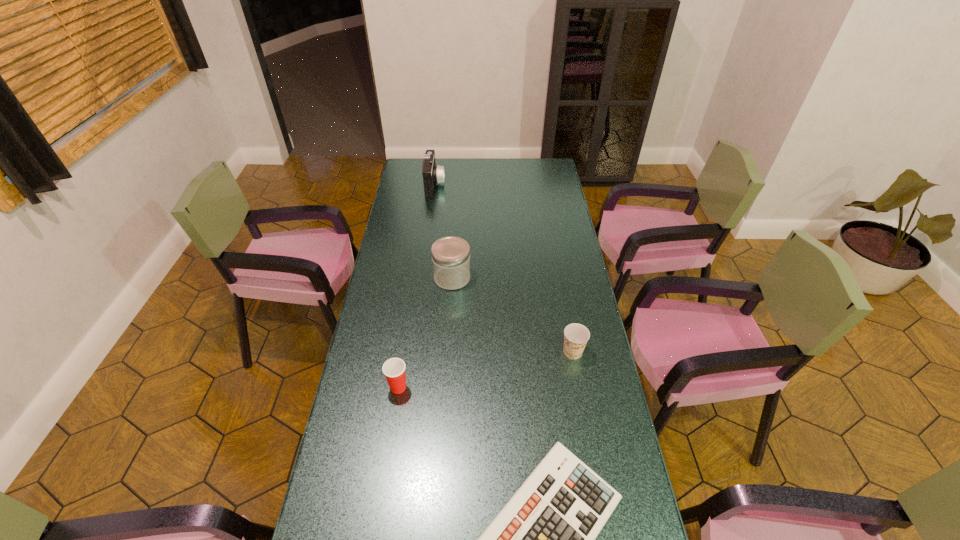
The image size is (960, 540). Identify the location of free space between the farthest object and the jar. (444, 231).

The image size is (960, 540). In order to click on empty space between the second nearest object and the camcorder in this screenshot , I will do [417, 286].

At what (x,y) coordinates should I click in order to perform the action: click on vacant area between the right Dixie cup and the nearer Dixie cup. Please return your answer as a coordinate pair (x, y). This screenshot has height=540, width=960. Looking at the image, I should click on (486, 369).

Locate an element on the screen. The image size is (960, 540). vacant area that lies between the camcorder and the nearer Dixie cup is located at coordinates (417, 286).

Locate an element on the screen. The height and width of the screenshot is (540, 960). blank region between the farthest object and the right Dixie cup is located at coordinates (504, 268).

Image resolution: width=960 pixels, height=540 pixels. In order to click on free space between the right Dixie cup and the farthest object in this screenshot , I will do `click(504, 268)`.

This screenshot has height=540, width=960. Identify the location of object that is the fourth nearest to the jar. (543, 539).

Locate which object is the closest to the farther Dixie cup. Please provide its 2D coordinates. Your answer should be formatted as a tuple, i.e. [(x, y)], where the tuple contains the x and y coordinates of a point satisfying the conditions above.

[(543, 539)]

I want to click on vacant space that satisfies the following two spatial constraints: 1. on the lens of the farthest object; 2. on the left side of the jar, so click(x=421, y=278).

Locate an element on the screen. The height and width of the screenshot is (540, 960). vacant area in the image that satisfies the following two spatial constraints: 1. on the lens of the farther Dixie cup; 2. on the right side of the camcorder is located at coordinates (412, 352).